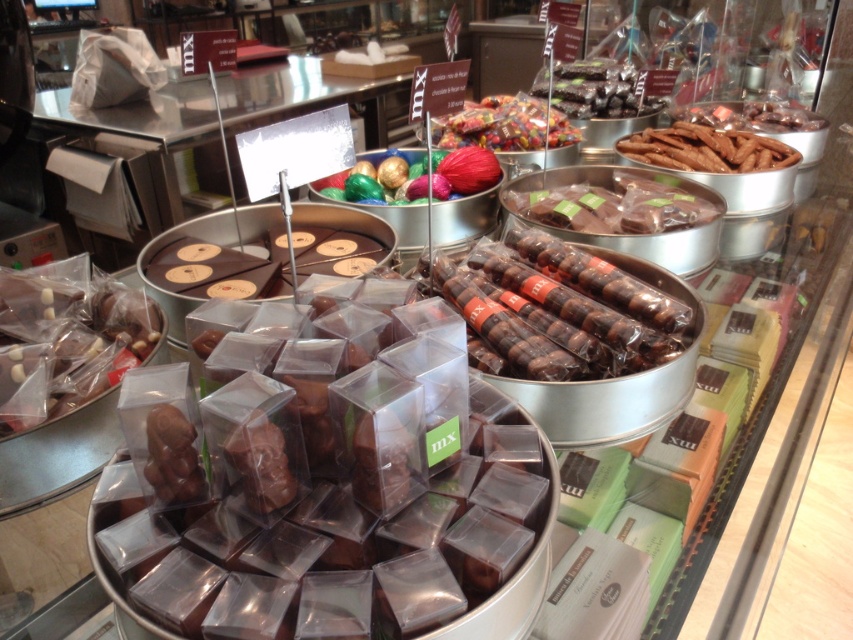
Question: Considering the real-world distances, which object is farthest from the shiny chocolate truffle at upper center?

Choices:
 (A) matte chocolate candy at left
 (B) matte chocolate bear at center
 (C) chocolate-coated truffles at center

Answer: (B)

Question: Which of the following is the farthest from the observer?

Choices:
 (A) matte chocolate candy at left
 (B) translucent plastic candy at center
 (C) shiny chocolate truffle at upper center

Answer: (C)

Question: Can you confirm if shiny chocolate bar at center is thinner than shiny chocolate truffle at upper center?

Choices:
 (A) yes
 (B) no

Answer: (B)

Question: Is matte chocolate bear at center positioned before shiny chocolate bar at center?

Choices:
 (A) yes
 (B) no

Answer: (A)

Question: Estimate the real-world distances between objects in this image. Which object is closer to the matte chocolate candy at left?

Choices:
 (A) chocolate-coated truffles at center
 (B) translucent plastic candy at center

Answer: (A)

Question: Is matte chocolate bear at center wider than brown matte chocolate sticks at upper right?

Choices:
 (A) yes
 (B) no

Answer: (A)